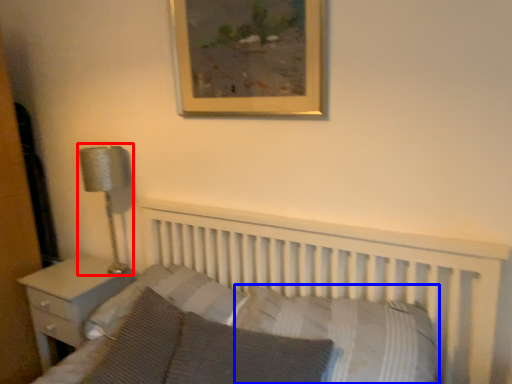
Question: Which of the following is the closest to the observer, lamp (highlighted by a red box) or pillow (highlighted by a blue box)?

Choices:
 (A) lamp
 (B) pillow

Answer: (B)